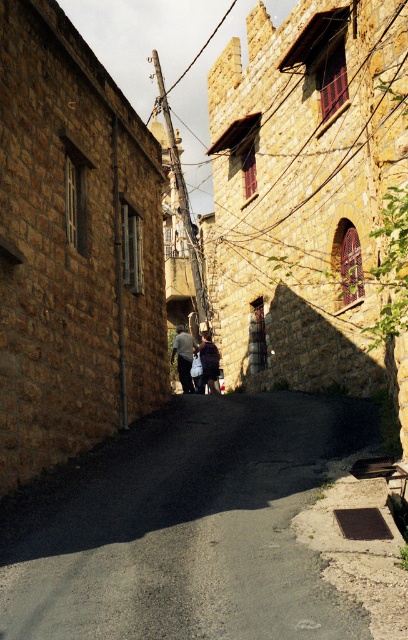
Question: Does asphalt at center appear over dark gray fabric at center?

Choices:
 (A) no
 (B) yes

Answer: (A)

Question: Among these points, which one is farthest from the camera?

Choices:
 (A) (184, 342)
 (B) (77, 476)
 (C) (201, 358)

Answer: (C)

Question: Where is asphalt at center located in relation to dark blue fabric at center in the image?

Choices:
 (A) right
 (B) left

Answer: (B)

Question: Which object is closer to the camera taking this photo?

Choices:
 (A) dark gray fabric at center
 (B) dark blue fabric at center
 (C) asphalt at center

Answer: (C)

Question: Which point appears closest to the camera in this image?

Choices:
 (A) (215, 376)
 (B) (192, 342)

Answer: (A)

Question: Does asphalt at center have a lesser width compared to dark blue fabric at center?

Choices:
 (A) no
 (B) yes

Answer: (A)